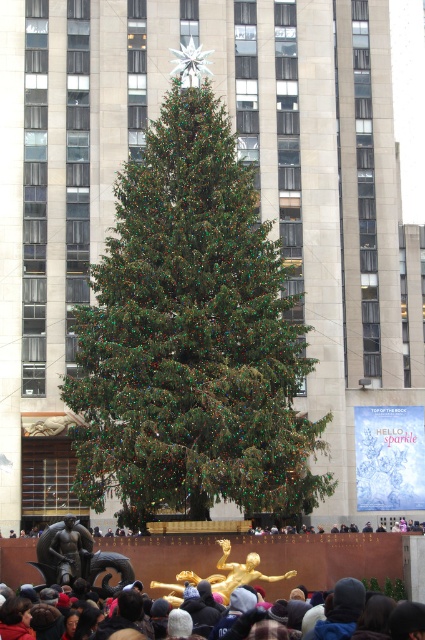
You are a photographer trying to capture a photo of the green matte christmas tree at center and the dark gray knit hats at lower center. Which object appears bigger in the photo?

The green matte christmas tree at center appears bigger in the photo because it is larger in size than the dark gray knit hats at lower center.

From the picture: You are a photographer trying to capture a photo of the green matte christmas tree at center and the dark gray knit hats at lower center in the same frame. Based on their sizes, which object should you focus on first to ensure both are in focus?

The green matte christmas tree at center is taller than dark gray knit hats at lower center, so you should focus on the green matte christmas tree at center first to ensure both are in focus since it is larger and occupies more space in the frame.

You are standing in front of the Christmas tree and want to take a photo of the green matte Christmas tree at center and the dark gray knit hats at lower center. Which object will appear larger in your photo?

The green matte Christmas tree at center will appear larger in your photo because it is closer to the viewer than the dark gray knit hats at lower center.